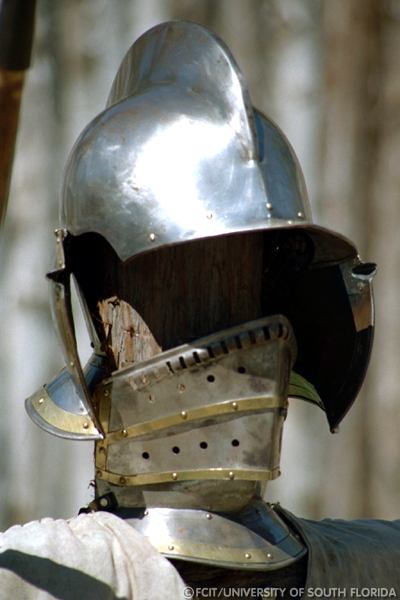
Where is `robe`? This screenshot has width=400, height=600. robe is located at coordinates point(352,577).